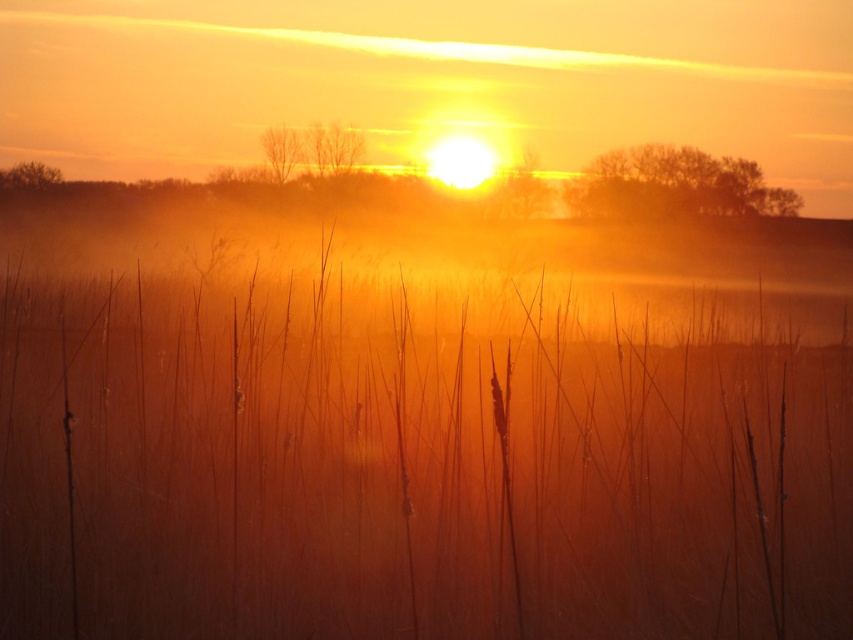
Question: Can you confirm if foggy mist at center is bigger than brown leafless tree at upper center?

Choices:
 (A) no
 (B) yes

Answer: (B)

Question: Does translucent golden tree at upper center appear on the right side of brown textured tree at upper center?

Choices:
 (A) yes
 (B) no

Answer: (A)

Question: Considering the relative positions of bare branches at center and brown matte tree at upper left in the image provided, where is bare branches at center located with respect to brown matte tree at upper left?

Choices:
 (A) right
 (B) left

Answer: (A)

Question: Which object is farther from the camera taking this photo?

Choices:
 (A) brown leafless tree at upper center
 (B) bare branches at center

Answer: (A)

Question: Which point is closer to the camera taking this photo?

Choices:
 (A) (312, 140)
 (B) (529, 160)

Answer: (A)

Question: Based on their relative distances, which object is farther from the brown matte grass at center?

Choices:
 (A) foggy mist at center
 (B) brown textured tree at upper center

Answer: (A)